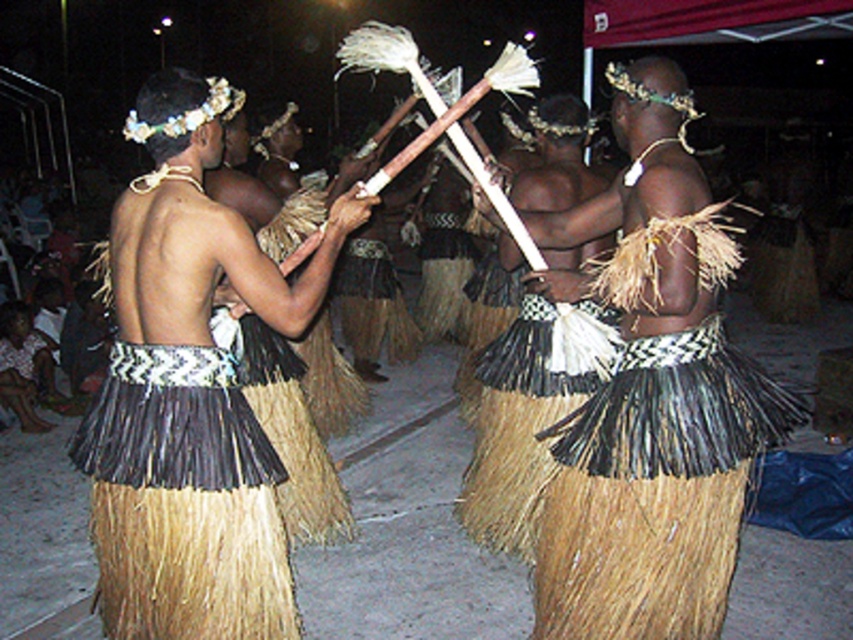
Between natural straw skirt at center and black woven grass skirt at center, which one appears on the left side from the viewer's perspective?

black woven grass skirt at center

Does natural straw skirt at center appear on the left side of black woven grass skirt at center?

No, natural straw skirt at center is not to the left of black woven grass skirt at center.

Is point (132, 224) farther from camera compared to point (112, 579)?

No, it is not.

The height and width of the screenshot is (640, 853). Identify the location of natural straw skirt at center. (190, 394).